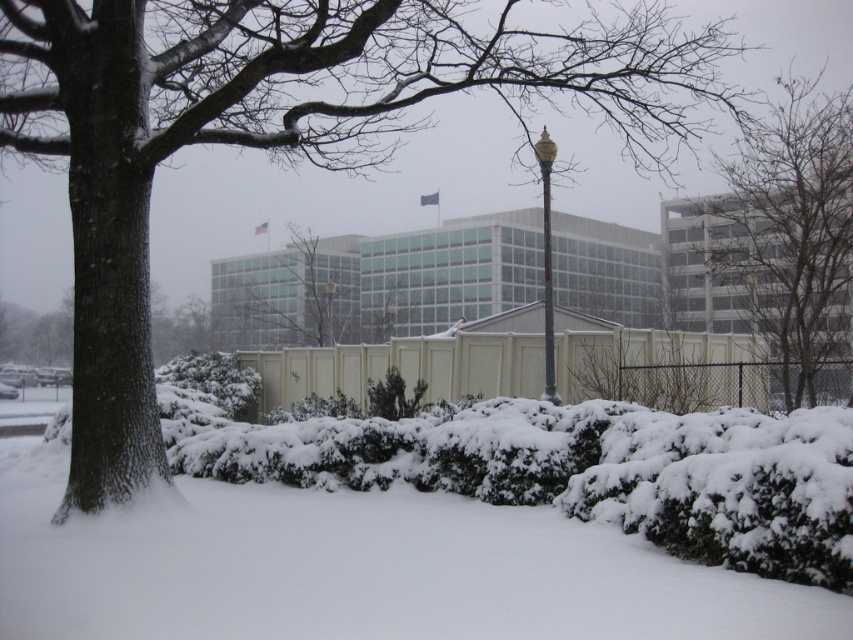
Question: Is bare branches at center bigger than gold polished metal lamp post at upper center?

Choices:
 (A) yes
 (B) no

Answer: (A)

Question: Can you confirm if bare branches at center is smaller than gold polished metal lamp post at upper center?

Choices:
 (A) no
 (B) yes

Answer: (A)

Question: Which point is farther to the camera?

Choices:
 (A) (775, 294)
 (B) (328, 308)
 (C) (349, 72)
 (D) (541, 132)

Answer: (C)

Question: Which object is closer to the camera taking this photo?

Choices:
 (A) snow-covered tree at left
 (B) gold polished metal lamp post at upper center
 (C) bare branches at center

Answer: (A)

Question: Does bare branches at center have a smaller size compared to gold polished metal lamp post at upper center?

Choices:
 (A) yes
 (B) no

Answer: (B)

Question: Which is farther from the gold polished metal lamp post at upper center?

Choices:
 (A) gold polished lamp post at center
 (B) bare branches at center

Answer: (A)